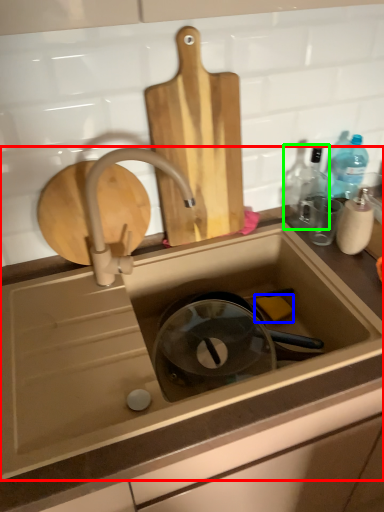
Question: Based on their relative distances, which object is farther from sink (highlighted by a red box)? Choose from soap (highlighted by a blue box) and bottle (highlighted by a green box).

Choices:
 (A) soap
 (B) bottle

Answer: (B)